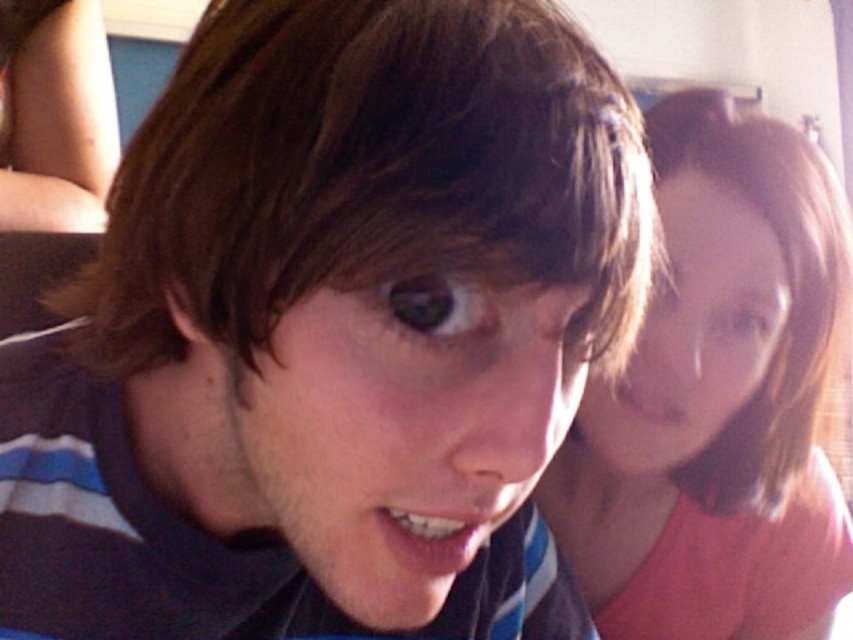
You are standing in the room and see two points marked in the image. The first point is at coordinate point [730,320] and the second is at point [103,116]. Which point is closer to you?

Point [730,320] is closer to the viewer than point [103,116].

You are a photographer trying to capture a detailed shot of both the pink matte shirt at upper right and the matte black shirt at upper left. Based on their positions, which shirt should you focus on first to ensure it appears sharp in the photo?

You should focus on the pink matte shirt at upper right first because it is closer to the viewer than the matte black shirt at upper left, so adjusting focus starting from the closer object ensures both will be in focus if using proper depth of field techniques.

You are designing a layout for a catalog and need to arrange the pink matte shirt at upper right and the matte black shirt at upper left. Based on their positions in the image, which shirt should be placed higher in the catalog layout?

The matte black shirt at upper left should be placed higher in the catalog layout because in the image, the pink matte shirt at upper right is below it.